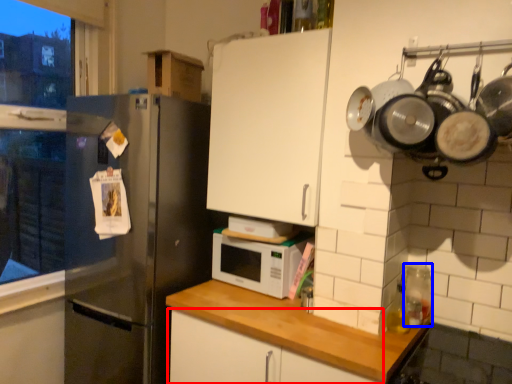
Question: Which of the following is the closest to the observer, cabinetry (highlighted by a red box) or appliance (highlighted by a blue box)?

Choices:
 (A) cabinetry
 (B) appliance

Answer: (A)